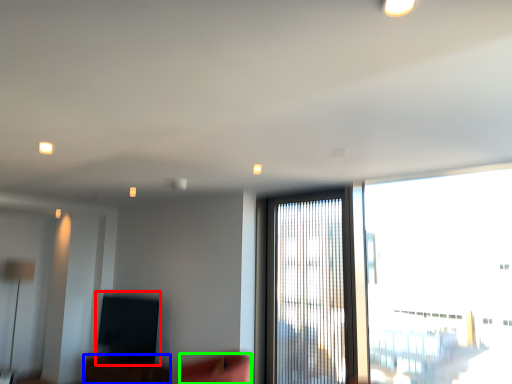
Question: Which object is positioned farthest from window screen (highlighted by a red box)? Select from furniture (highlighted by a blue box) and swivel chair (highlighted by a green box).

Choices:
 (A) furniture
 (B) swivel chair

Answer: (B)